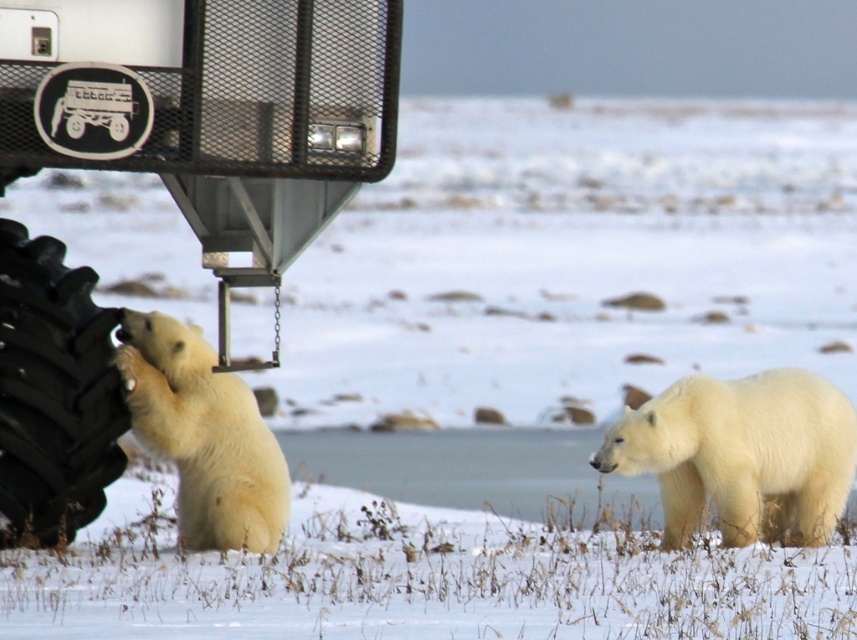
You are a wildlife researcher observing polar bears in a snowy landscape. You need to determine if the white fluffy polar bear at right can safely approach the black rubber tire at lower left without getting too close. The safe distance for observation is 8 feet. Can the polar bear approach the tire while maintaining this safe distance?

The white fluffy polar bear at right is currently 8.28 feet away from the black rubber tire at lower left. Since the safe distance is 8 feet, the polar bear can approach slightly closer but would need to stop before reaching 8 feet to maintain safety. Alternatively, if staying at the current distance, it is already beyond the minimum safe distance.

You are a wildlife photographer trying to capture a photo of the white fur polar bear at center. However, the black rubber tire at lower left is blocking your view. Can you move to the right or left to avoid the tire?

The black rubber tire at lower left is to the left of the white fur polar bear at center. Therefore, moving to the right would allow you to avoid the tire and get a clear view of the white fur polar bear at center.